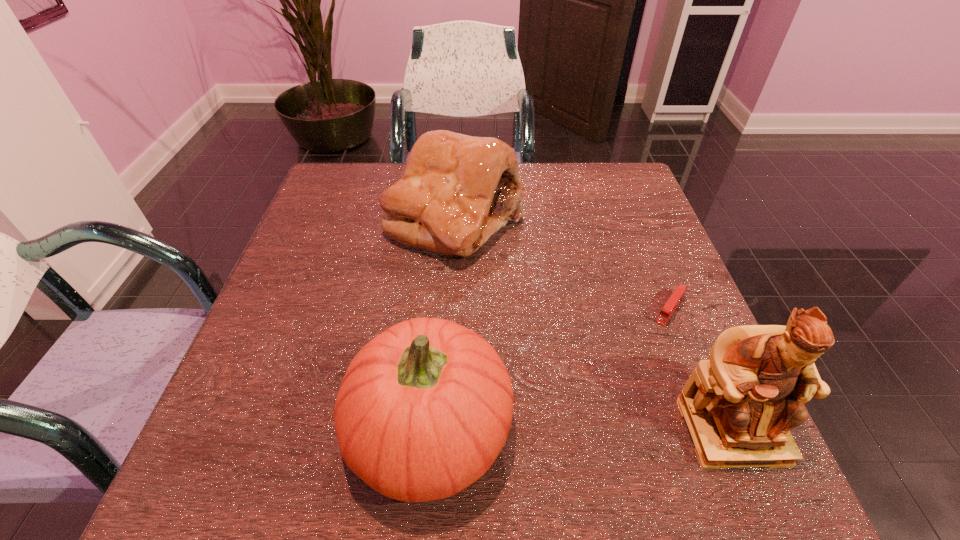
You are a GUI agent. You are given a task and a screenshot of the screen. Output one action in this format:
    pyautogui.click(x=<x>, y=<y>)
    Task: Click on the vacant space on the desktop that is between the pumpkin and the figurine and is positioned on the filling side of the bread
    The image size is (960, 540).
    Given the screenshot: What is the action you would take?
    pyautogui.click(x=589, y=429)

Locate an element on the screen. The height and width of the screenshot is (540, 960). vacant space on the desktop that is between the pumpkin and the figurine and is positioned on the front-facing side of the shortest object is located at coordinates (589, 429).